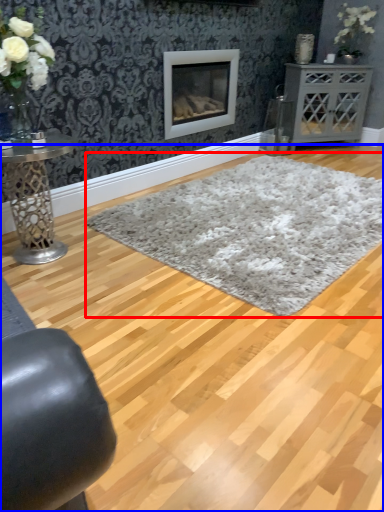
Question: Which object is closer to the camera taking this photo, plain (highlighted by a red box) or plain (highlighted by a blue box)?

Choices:
 (A) plain
 (B) plain

Answer: (B)